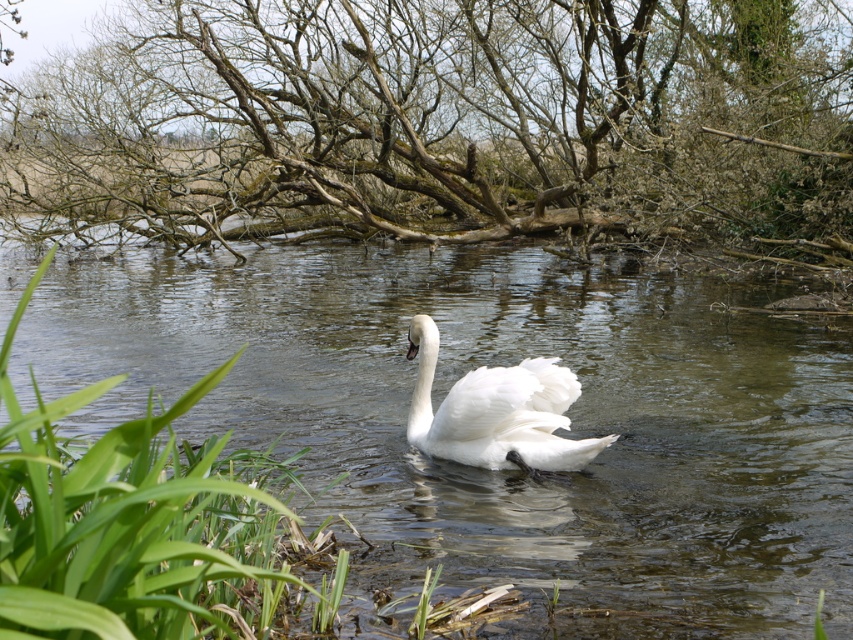
Question: Does brown/mossy tree at upper center come behind white feathered swan at center?

Choices:
 (A) no
 (B) yes

Answer: (B)

Question: Which point is farther to the camera?

Choices:
 (A) (160, 148)
 (B) (421, 420)
 (C) (189, 323)

Answer: (A)

Question: Is clear water at center bigger than white feathered swan at center?

Choices:
 (A) no
 (B) yes

Answer: (B)

Question: Which point is farther to the camera?

Choices:
 (A) clear water at center
 (B) brown/mossy tree at upper center
 (C) white feathered swan at center

Answer: (B)

Question: Considering the real-world distances, which object is farthest from the brown/mossy tree at upper center?

Choices:
 (A) white feathered swan at center
 (B) clear water at center

Answer: (A)

Question: Can you confirm if brown/mossy tree at upper center is positioned to the left of white feathered swan at center?

Choices:
 (A) no
 (B) yes

Answer: (B)